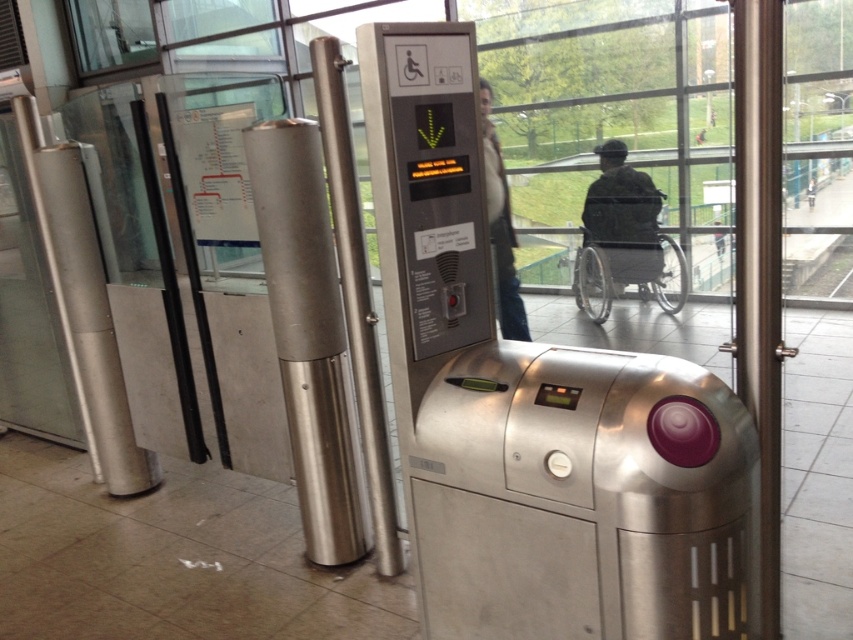
Consider the image. Measure the distance from satin silver pole at center to brown leather jacket at upper center.

satin silver pole at center is 3.03 meters away from brown leather jacket at upper center.

Is satin silver pole at center positioned in front of brown leather jacket at upper center?

Yes.

Between point (320, 64) and point (511, 292), which one is positioned behind?

The point (511, 292) is behind.

Locate an element on the screen. This screenshot has width=853, height=640. satin silver pole at center is located at coordinates (357, 296).

Does satin silver pole at center have a smaller size compared to camouflage fabric wheelchair at center?

No, satin silver pole at center is not smaller than camouflage fabric wheelchair at center.

Does point (364, 316) lie behind point (645, 272)?

That is False.

Is point (381, 442) farther from viewer compared to point (614, 160)?

No.

Locate an element on the screen. Image resolution: width=853 pixels, height=640 pixels. satin silver pole at center is located at coordinates (357, 296).

Is silver metallic pillar at left closer to the viewer compared to camouflage fabric wheelchair at center?

Yes, silver metallic pillar at left is closer to the viewer.

Which is more to the left, silver metallic pillar at left or camouflage fabric wheelchair at center?

silver metallic pillar at left is more to the left.

Is point (82, 276) positioned behind point (604, 186)?

No.

Locate an element on the screen. This screenshot has width=853, height=640. silver metallic pillar at left is located at coordinates (90, 317).